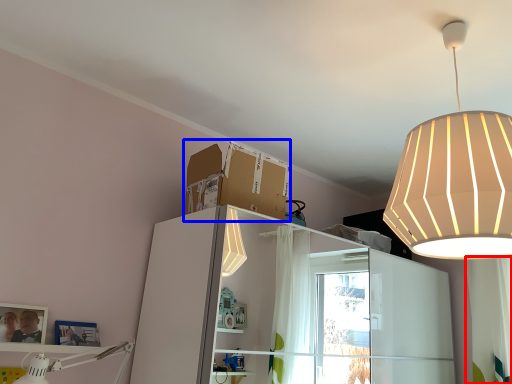
Question: Which object appears farthest to the camera in this image, curtain (highlighted by a red box) or cardboard box (highlighted by a blue box)?

Choices:
 (A) curtain
 (B) cardboard box

Answer: (A)